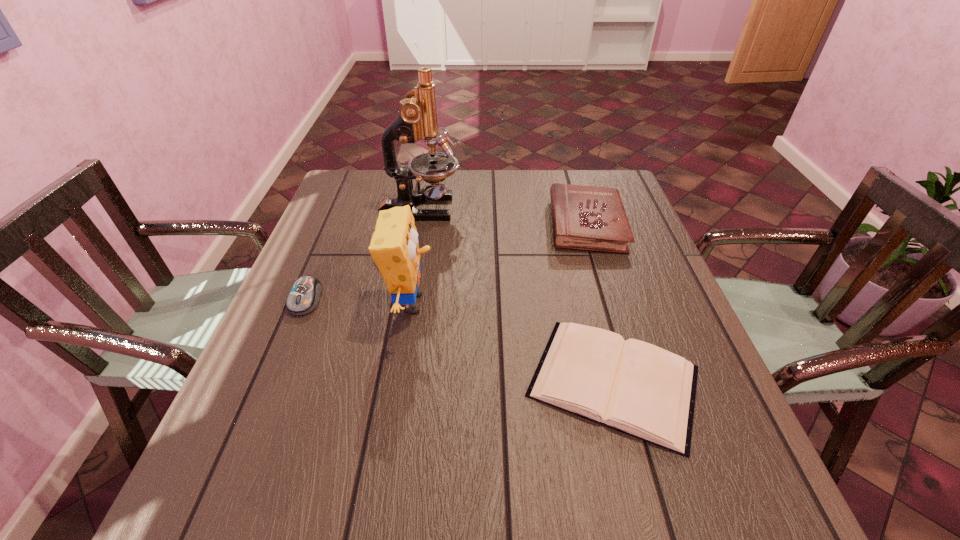
Where is `blank space that satisfies the following two spatial constraints: 1. at the eyepiece of the microscope; 2. on the back side of the farther hardback book`? The width and height of the screenshot is (960, 540). blank space that satisfies the following two spatial constraints: 1. at the eyepiece of the microscope; 2. on the back side of the farther hardback book is located at coordinates (418, 225).

At what (x,y) coordinates should I click in order to perform the action: click on free space in the image that satisfies the following two spatial constraints: 1. at the eyepiece of the tallest object; 2. on the left side of the shortest object. Please return your answer as a coordinate pair (x, y). The height and width of the screenshot is (540, 960). Looking at the image, I should click on (389, 381).